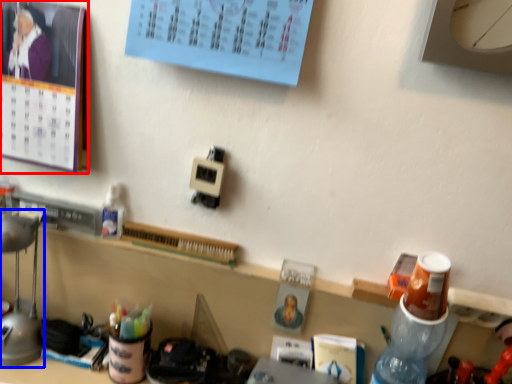
Question: Which point is closer to the camera, bulletin board (highlighted by a red box) or lamp (highlighted by a blue box)?

Choices:
 (A) bulletin board
 (B) lamp

Answer: (A)